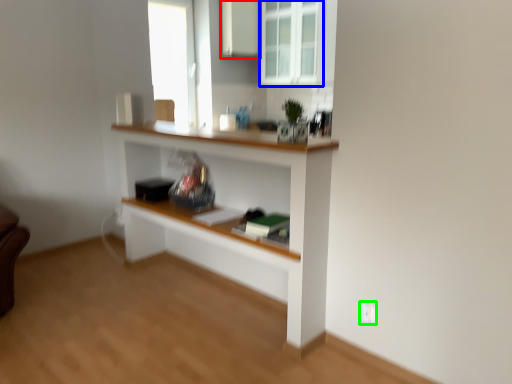
Question: Based on their relative distances, which object is nearer to cabinetry (highlighted by a red box)? Choose from window (highlighted by a blue box) and electric outlet (highlighted by a green box).

Choices:
 (A) window
 (B) electric outlet

Answer: (A)